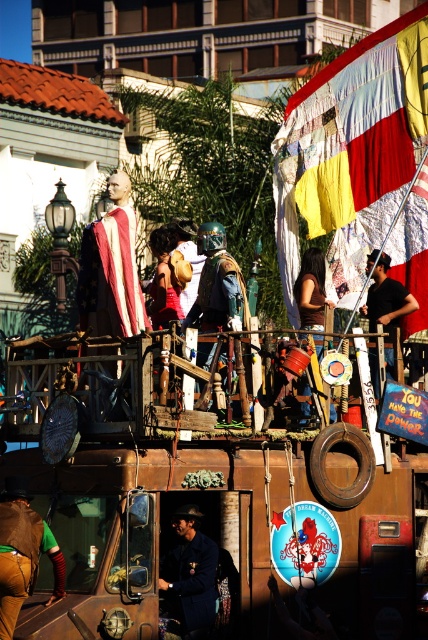
Does red fabric at center have a lesser height compared to brown fabric at center?

Yes.

Does red fabric at center have a greater width compared to brown fabric at center?

Indeed, red fabric at center has a greater width compared to brown fabric at center.

Between point (174, 256) and point (314, 248), which one is positioned behind?

The point (314, 248) is more distant.

Identify the location of red fabric at center. The image size is (428, 640). (166, 278).

Who is more forward, (419,65) or (404,308)?

Point (404,308) is in front.

Between point (419, 237) and point (386, 356), which one is positioned in front?

Point (386, 356)

In order to click on quilted fabric flag at upper right in this screenshot , I will do `click(350, 150)`.

Which is in front, point (397, 296) or point (312, 312)?

Positioned in front is point (312, 312).

Is matte black shirt at center to the left of brown fabric at center from the viewer's perspective?

In fact, matte black shirt at center is to the right of brown fabric at center.

Who is more distant from viewer, (404, 305) or (321, 294)?

The point (321, 294) is behind.

At what (x,y) coordinates should I click in order to perform the action: click on matte black shirt at center. Please return your answer as a coordinate pair (x, y). The image size is (428, 640). Looking at the image, I should click on (385, 292).